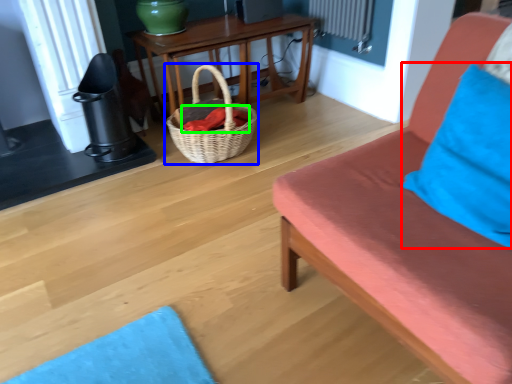
Question: Which object is positioned farthest from pillow (highlighted by a red box)? Select from picnic basket (highlighted by a blue box) and material (highlighted by a green box).

Choices:
 (A) picnic basket
 (B) material

Answer: (B)